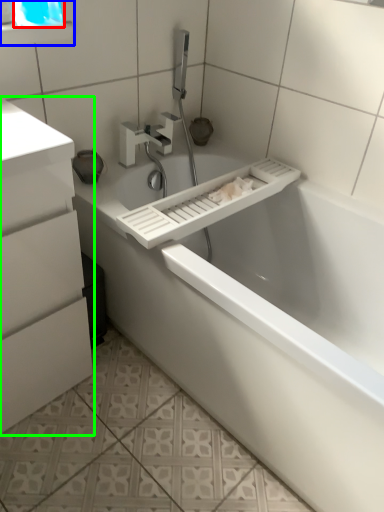
Question: Which is farther away from window screen (highlighted by a red box)? medicine cabinet (highlighted by a blue box) or bathroom cabinet (highlighted by a green box)?

Choices:
 (A) medicine cabinet
 (B) bathroom cabinet

Answer: (B)